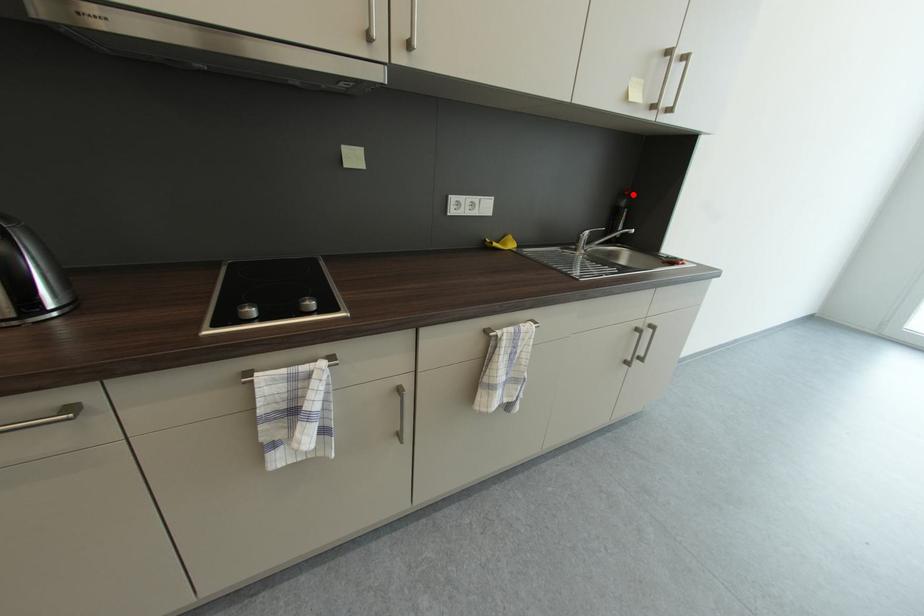
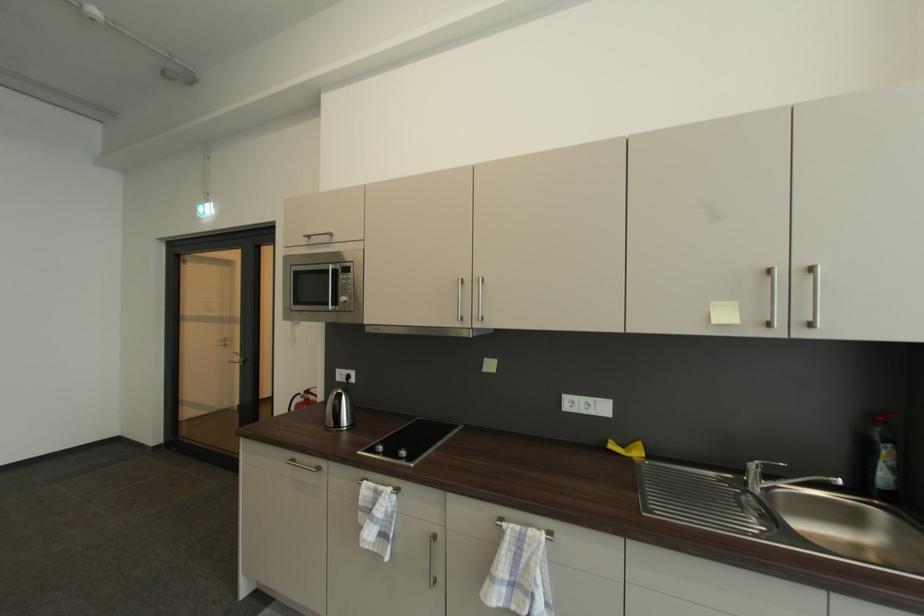
Question: I am providing you with two images of the same scene from different viewpoints. A red point is marked on the first image. Can you still see the location of the red point in image 2?

Choices:
 (A) Yes
 (B) No

Answer: (A)